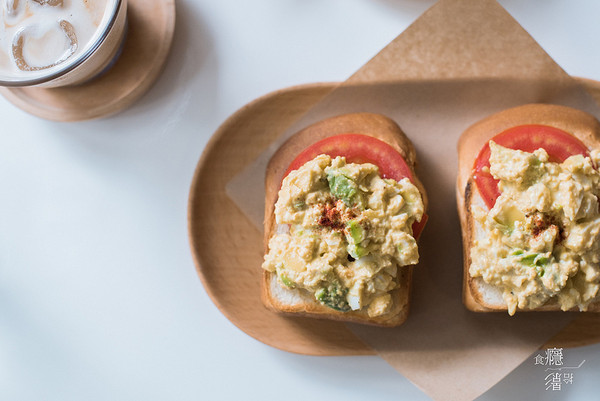
Image resolution: width=600 pixels, height=401 pixels. I want to click on table top, so click(145, 234).